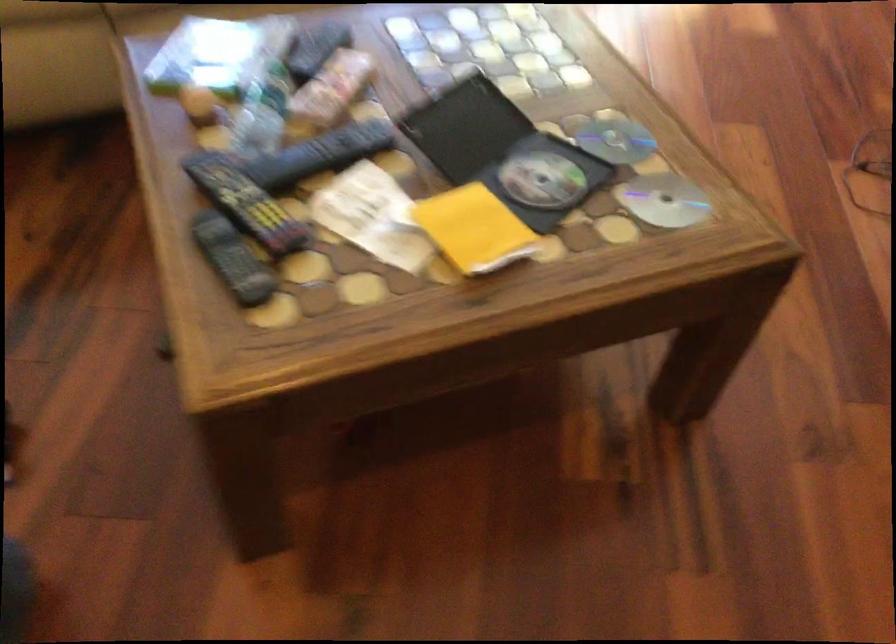
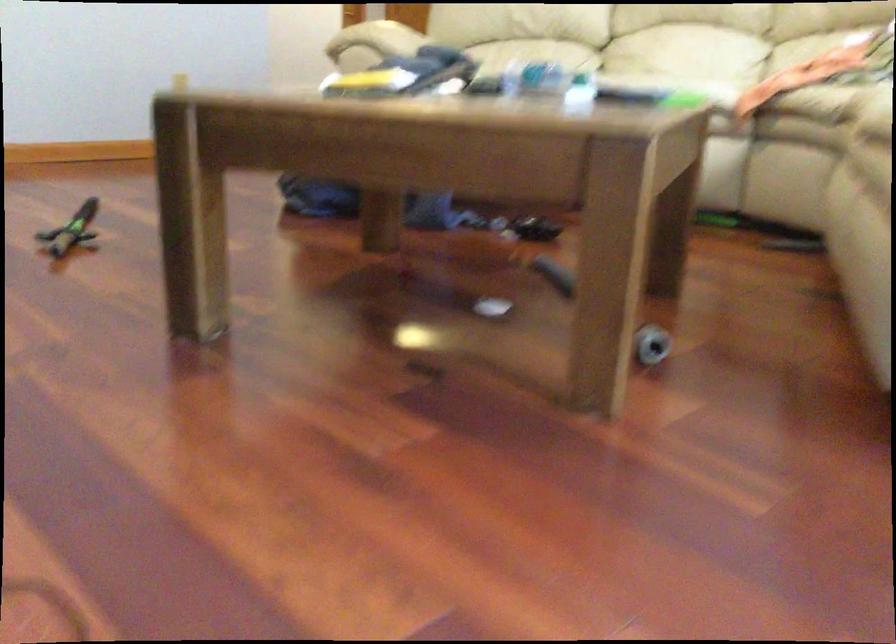
Question: I am providing you with two images of the same scene from different viewpoints. Please identify which objects are invisible in image2.

Choices:
 (A) clear plastic bottle
 (B) green toy sword
 (C) clear blender pitcher
 (D) black remote control

Answer: (D)